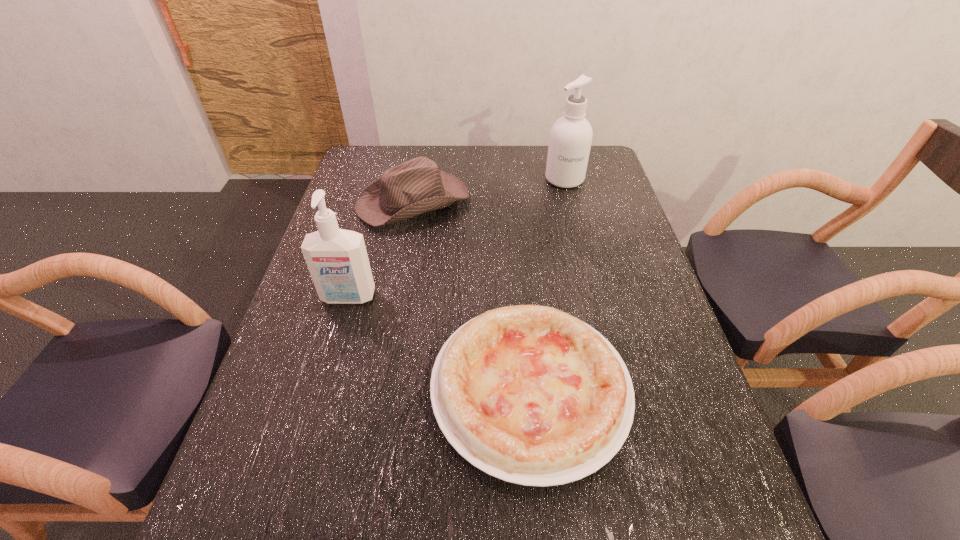
Where is `vacant space at the right edge of the desktop`? Image resolution: width=960 pixels, height=540 pixels. vacant space at the right edge of the desktop is located at coordinates (621, 336).

Find the location of a particular element. The width and height of the screenshot is (960, 540). vacant space at the far left corner of the desktop is located at coordinates (356, 164).

Image resolution: width=960 pixels, height=540 pixels. I want to click on free area in between the left cleansing agent and the shortest object, so click(439, 343).

What are the coordinates of `vacant area between the fedora and the pizza` in the screenshot? It's located at (471, 295).

Find the location of a particular element. free area in between the second nearest object and the shortest object is located at coordinates (439, 343).

This screenshot has height=540, width=960. Find the location of `unoccupied area between the fedora and the nearest object`. unoccupied area between the fedora and the nearest object is located at coordinates (471, 295).

You are a GUI agent. You are given a task and a screenshot of the screen. Output one action in this format:
    pyautogui.click(x=<x>, y=<y>)
    Task: Click on the vacant area that lies between the second shortest object and the shortest object
    This screenshot has width=960, height=540.
    Given the screenshot: What is the action you would take?
    pyautogui.click(x=471, y=295)

Where is `unoccupied position between the fedora and the right cleansing agent`? unoccupied position between the fedora and the right cleansing agent is located at coordinates (489, 190).

Identify the location of vacant region between the shortest object and the nearer cleansing agent. pyautogui.click(x=439, y=343).

You are a GUI agent. You are given a task and a screenshot of the screen. Output one action in this format:
    pyautogui.click(x=<x>, y=<y>)
    Task: Click on the free space between the right cleansing agent and the second shortest object
    
    Given the screenshot: What is the action you would take?
    pyautogui.click(x=489, y=190)